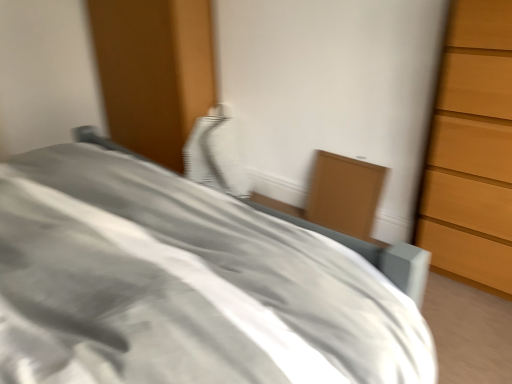
Question: Is gray fabric bed at center situated inside white textured pillow at center or outside?

Choices:
 (A) outside
 (B) inside

Answer: (A)

Question: Considering the relative positions of gray fabric bed at center and white textured pillow at center in the image provided, is gray fabric bed at center to the left or to the right of white textured pillow at center?

Choices:
 (A) right
 (B) left

Answer: (B)

Question: Which object is positioned closest to the white textured pillow at center?

Choices:
 (A) gray fabric bed at center
 (B) matte wood cabinet at center-right

Answer: (B)

Question: Based on their relative distances, which object is nearer to the gray fabric bed at center?

Choices:
 (A) white textured pillow at center
 (B) matte wood cabinet at center-right

Answer: (B)